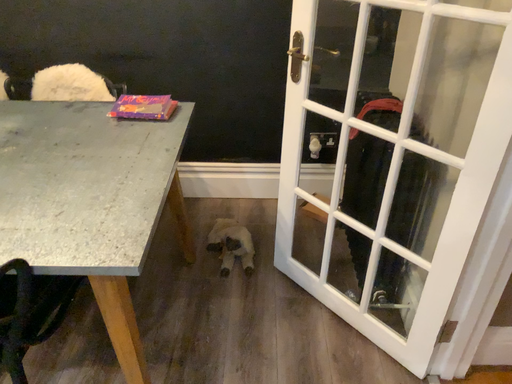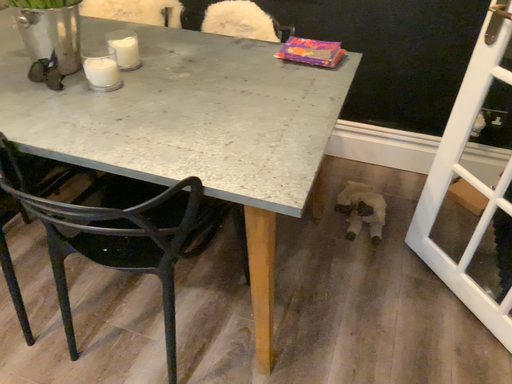
Question: Which way did the camera rotate in the video?

Choices:
 (A) rotated right
 (B) rotated left

Answer: (B)